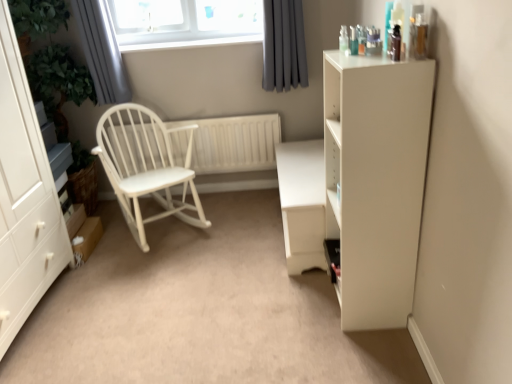
Find the location of `white matte table at center`. white matte table at center is located at coordinates click(302, 203).

What do you see at coordinates (302, 203) in the screenshot? I see `white matte table at center` at bounding box center [302, 203].

Where is `white wood rocking chair at left`? The image size is (512, 384). white wood rocking chair at left is located at coordinates (145, 166).

What do you see at coordinates (102, 51) in the screenshot?
I see `gray fabric curtain at upper left, the 1th curtain viewed from the left` at bounding box center [102, 51].

What do you see at coordinates (200, 311) in the screenshot?
I see `white wood desk at center` at bounding box center [200, 311].

Describe the element at coordinates (24, 197) in the screenshot. This screenshot has height=384, width=512. I see `white matte cabinet at left` at that location.

The image size is (512, 384). I want to click on gray fabric curtain at upper center, which is counted as the 1th curtain, starting from the right, so click(283, 45).

Is white wood radiator at center next to white wood desk at center and touching it?

No.

In order to click on plain on the right of white wood radiator at center in this screenshot , I will do `click(200, 311)`.

From the image's perspective, who appears lower, white wood radiator at center or white wood desk at center?

white wood desk at center is shown below in the image.

Which object is more forward, white wood radiator at center or white wood desk at center?

white wood desk at center.

Does point (293, 209) come behind point (413, 66)?

Yes, point (293, 209) is farther from viewer.

Is white matte table at center positioned behind white matte cabinet at right?

Yes, white matte table at center is further from the viewer.

Is white matte table at center not close to white matte cabinet at right?

No.

Is white matte table at center positioned beyond the bounds of white matte cabinet at right?

Absolutely, white matte table at center is external to white matte cabinet at right.

Between white wood rocking chair at left and white matte table at center, which one is positioned behind?

white wood rocking chair at left is more distant.

Which is more to the right, white wood rocking chair at left or white matte table at center?

Positioned to the right is white matte table at center.

Which object is wider, white wood rocking chair at left or white matte table at center?

white wood rocking chair at left.

In terms of height, does white matte cabinet at right look taller or shorter compared to gray fabric curtain at upper center, acting as the second curtain starting from the left?

white matte cabinet at right is taller than gray fabric curtain at upper center, acting as the second curtain starting from the left.

Considering the sizes of white matte cabinet at right and gray fabric curtain at upper center, acting as the second curtain starting from the left, in the image, is white matte cabinet at right wider or thinner than gray fabric curtain at upper center, acting as the second curtain starting from the left,?

In the image, white matte cabinet at right appears to be wider than gray fabric curtain at upper center, acting as the second curtain starting from the left.

Would you say gray fabric curtain at upper center, acting as the second curtain starting from the left, is part of white matte cabinet at right's contents?

Actually, gray fabric curtain at upper center, acting as the second curtain starting from the left, is outside white matte cabinet at right.

Is white matte table at center in contact with white wood radiator at center?

No, white matte table at center is not making contact with white wood radiator at center.

Looking at this image, from the image's perspective, which is below, white matte table at center or white wood radiator at center?

white matte table at center.

Does white matte table at center come in front of white wood radiator at center?

Yes, it is in front of white wood radiator at center.

Measure the distance between white wood desk at center and gray fabric curtain at upper left, the 1th curtain viewed from the left.

white wood desk at center and gray fabric curtain at upper left, the 1th curtain viewed from the left, are 1.30 meters apart from each other.

Would you say white wood desk at center is outside gray fabric curtain at upper left, acting as the 2th curtain starting from the right?

Yes, white wood desk at center is located beyond the bounds of gray fabric curtain at upper left, acting as the 2th curtain starting from the right.

Which object is thinner, white wood desk at center or gray fabric curtain at upper left, acting as the 2th curtain starting from the right?

Thinner between the two is gray fabric curtain at upper left, acting as the 2th curtain starting from the right.

From the image's perspective, who appears lower, white wood desk at center or gray fabric curtain at upper left, acting as the 2th curtain starting from the right?

white wood desk at center is shown below in the image.

Does point (282, 52) come closer to viewer compared to point (97, 0)?

That is False.

Which object is closer to the camera, gray fabric curtain at upper center, acting as the second curtain starting from the left, or gray fabric curtain at upper left, acting as the 2th curtain starting from the right?

gray fabric curtain at upper left, acting as the 2th curtain starting from the right.

Can you confirm if gray fabric curtain at upper center, acting as the second curtain starting from the left, is thinner than gray fabric curtain at upper left, acting as the 2th curtain starting from the right?

Yes.

At what (x,y) coordinates should I click in order to perform the action: click on curtain below the gray fabric curtain at upper center, which is counted as the 1th curtain, starting from the right (from the image's perspective). Please return your answer as a coordinate pair (x, y). This screenshot has width=512, height=384. Looking at the image, I should click on (102, 51).

The height and width of the screenshot is (384, 512). Find the location of `radiator behind the white wood desk at center`. radiator behind the white wood desk at center is located at coordinates (233, 143).

What are the coordinates of `table below the white matte cabinet at right (from the image's perspective)` in the screenshot? It's located at (x=302, y=203).

Estimate the real-world distances between objects in this image. Which object is closer to white wood radiator at center, white wood desk at center or white wood rocking chair at left?

white wood rocking chair at left lies closer to white wood radiator at center than the other object.

Based on their spatial positions, is white wood desk at center or white matte cabinet at right closer to white wood radiator at center?

white wood desk at center lies closer to white wood radiator at center than the other object.

Looking at the image, which one is located further to white wood radiator at center, white matte cabinet at left or white matte table at center?

Based on the image, white matte cabinet at left appears to be further to white wood radiator at center.

Which object lies further to the anchor point gray fabric curtain at upper left, acting as the 2th curtain starting from the right, white wood desk at center or white wood radiator at center?

white wood desk at center is further to gray fabric curtain at upper left, acting as the 2th curtain starting from the right.

Looking at the image, which one is located closer to gray fabric curtain at upper center, which is counted as the 1th curtain, starting from the right, white matte table at center or white matte cabinet at right?

white matte table at center.

Looking at the image, which one is located closer to white matte cabinet at right, gray fabric curtain at upper center, acting as the second curtain starting from the left, or white wood radiator at center?

gray fabric curtain at upper center, acting as the second curtain starting from the left, lies closer to white matte cabinet at right than the other object.

Based on their spatial positions, is white wood rocking chair at left or gray fabric curtain at upper center, which is counted as the 1th curtain, starting from the right, further from white wood radiator at center?

gray fabric curtain at upper center, which is counted as the 1th curtain, starting from the right, is further to white wood radiator at center.

When comparing their distances from white matte table at center, does white matte cabinet at left or white matte cabinet at right seem further?

Among the two, white matte cabinet at left is located further to white matte table at center.

At what (x,y) coordinates should I click in order to perform the action: click on table between white matte cabinet at left and white wood radiator at center in the front-back direction. Please return your answer as a coordinate pair (x, y). Looking at the image, I should click on (302, 203).

Identify the location of table between gray fabric curtain at upper center, acting as the second curtain starting from the left, and white wood desk at center from top to bottom. The width and height of the screenshot is (512, 384). (302, 203).

You are a GUI agent. You are given a task and a screenshot of the screen. Output one action in this format:
    pyautogui.click(x=<x>, y=<y>)
    Task: Click on the chair between white wood desk at center and white wood radiator at center from front to back
    
    Given the screenshot: What is the action you would take?
    pyautogui.click(x=145, y=166)

Locate an element on the screen. This screenshot has width=512, height=384. radiator between white wood rocking chair at left and gray fabric curtain at upper center, acting as the second curtain starting from the left is located at coordinates (233, 143).